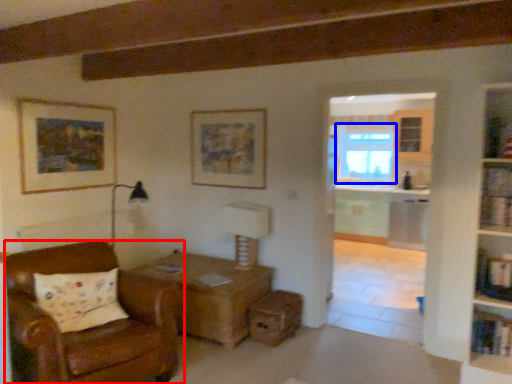
Question: Among these objects, which one is nearest to the camera, chair (highlighted by a red box) or window (highlighted by a blue box)?

Choices:
 (A) chair
 (B) window

Answer: (A)